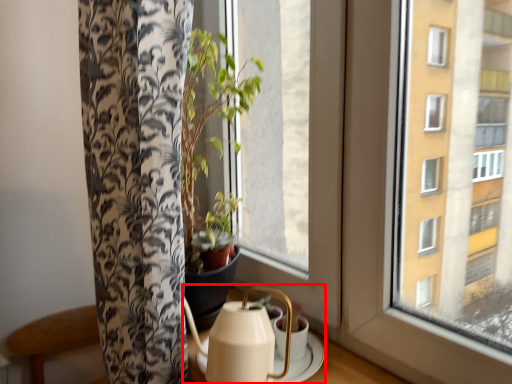
Question: Considering the relative positions of tea set (annotated by the red box) and window in the image provided, where is tea set (annotated by the red box) located with respect to the staircase?

Choices:
 (A) right
 (B) left

Answer: (A)